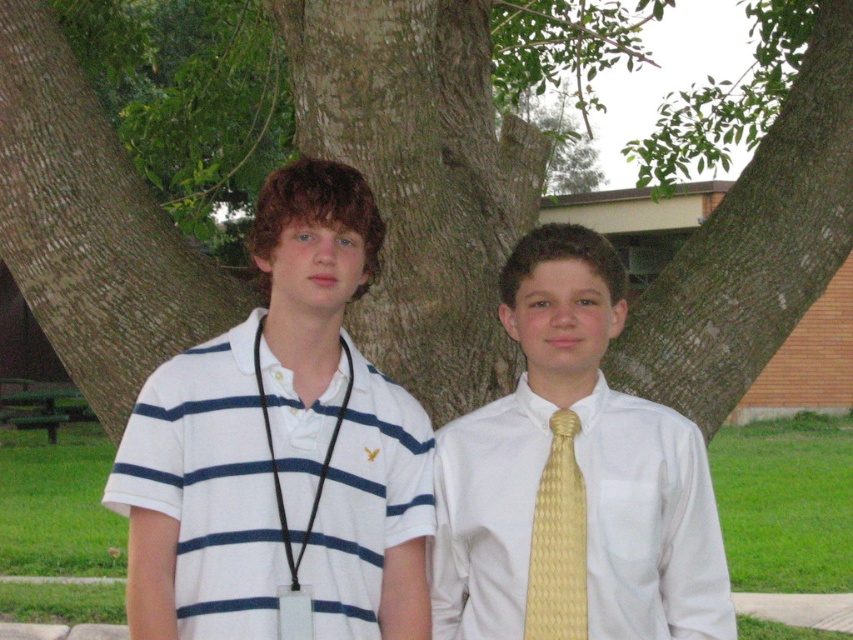
Question: Among these points, which one is nearest to the camera?

Choices:
 (A) (782, 259)
 (B) (582, 484)

Answer: (B)

Question: Is white striped polo shirt at left smaller than white satin shirt at center?

Choices:
 (A) yes
 (B) no

Answer: (B)

Question: From the image, what is the correct spatial relationship of green bark tree at center in relation to white satin shirt at center?

Choices:
 (A) below
 (B) above

Answer: (B)

Question: Observing the image, what is the correct spatial positioning of green bark tree at center in reference to white striped polo shirt at left?

Choices:
 (A) right
 (B) left

Answer: (A)

Question: Among these objects, which one is nearest to the camera?

Choices:
 (A) white satin shirt at center
 (B) green bark tree at center
 (C) yellow textured tie at center
 (D) white striped polo shirt at left

Answer: (D)

Question: Considering the real-world distances, which object is closest to the white striped polo shirt at left?

Choices:
 (A) green bark tree at center
 (B) yellow textured tie at center

Answer: (B)